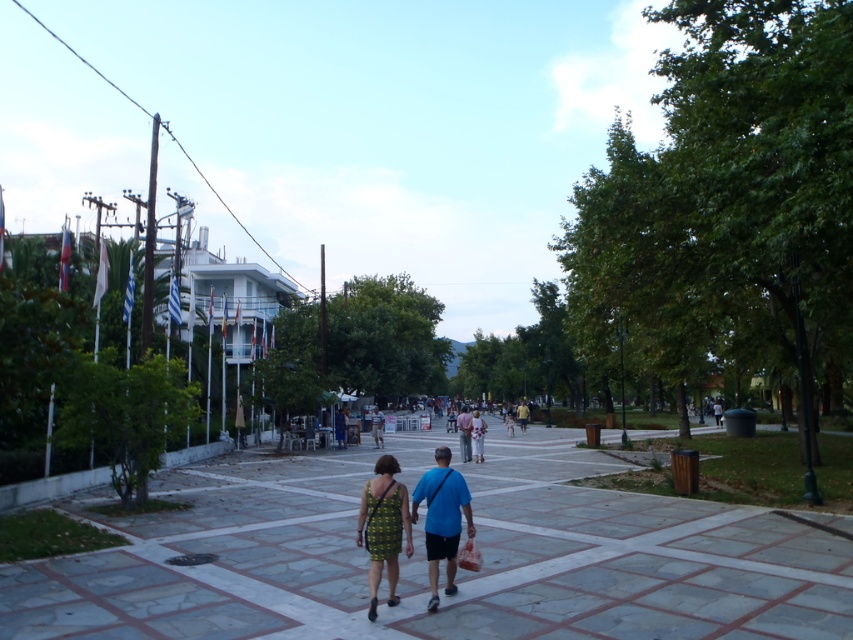
Question: Which point is closer to the camera taking this photo?

Choices:
 (A) (445, 490)
 (B) (477, 436)

Answer: (A)

Question: Does green textured dress at center come behind blue fabric bag at center?

Choices:
 (A) no
 (B) yes

Answer: (A)

Question: Does green textured dress at center appear under floral fabric dress at center?

Choices:
 (A) no
 (B) yes

Answer: (A)

Question: Which object is farther from the camera taking this photo?

Choices:
 (A) floral fabric dress at center
 (B) floral dress at center

Answer: (A)

Question: Can you confirm if blue fabric bag at center is thinner than blue fabric shirt at center?

Choices:
 (A) yes
 (B) no

Answer: (A)

Question: Based on their relative distances, which object is nearer to the blue fabric bag at center?

Choices:
 (A) gray stone pavement at center
 (B) blue fabric shirt at center
 (C) floral dress at center

Answer: (A)